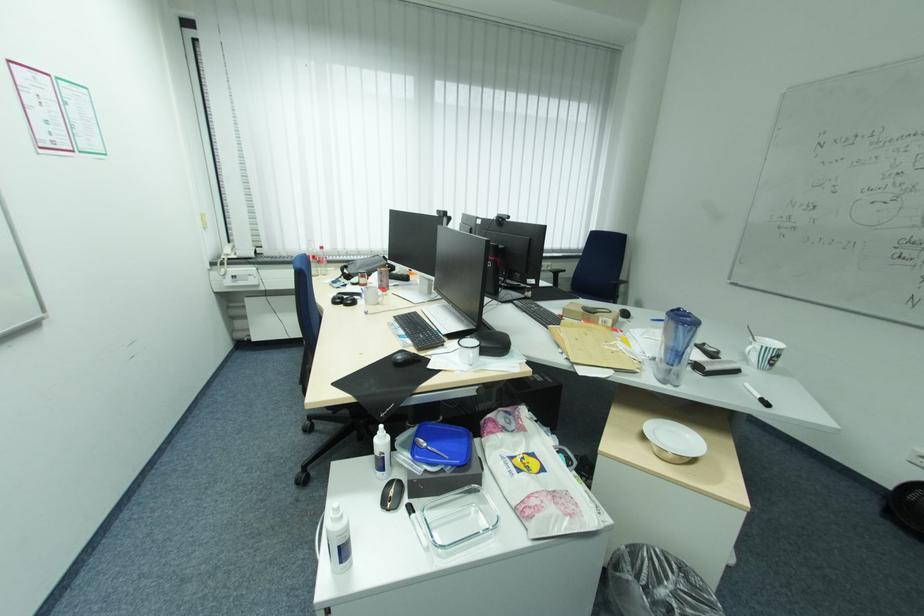
Find where to wear the black headphones. Please return your answer as a coordinate pair (x, y).

(346, 298)